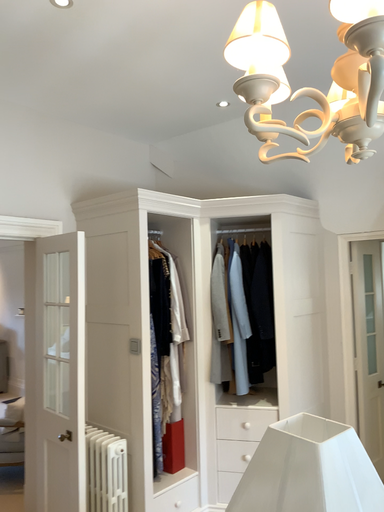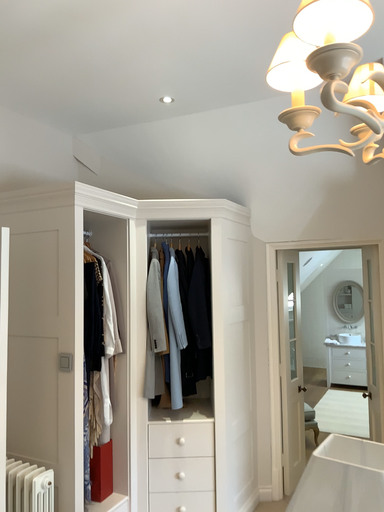
Question: How did the camera likely rotate when shooting the video?

Choices:
 (A) rotated left
 (B) rotated right

Answer: (B)